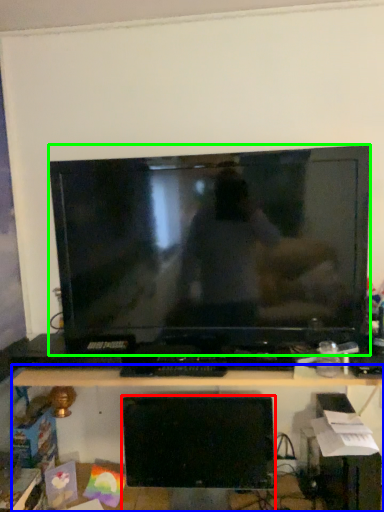
Question: Estimate the real-world distances between objects in this image. Which object is farther from computer monitor (highlighted by a red box), desk (highlighted by a blue box) or television (highlighted by a green box)?

Choices:
 (A) desk
 (B) television

Answer: (B)